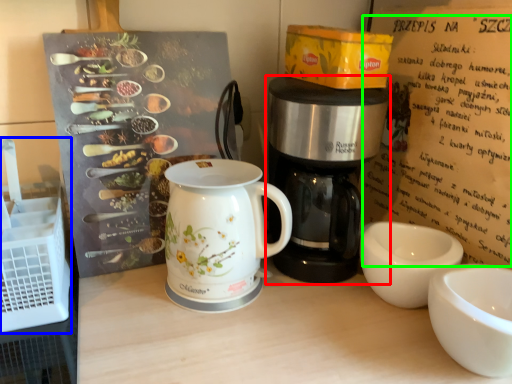
Question: Estimate the real-world distances between objects in this image. Which object is closer to coffee maker (highlighted by a red box), crate (highlighted by a blue box) or writing (highlighted by a green box)?

Choices:
 (A) crate
 (B) writing

Answer: (B)